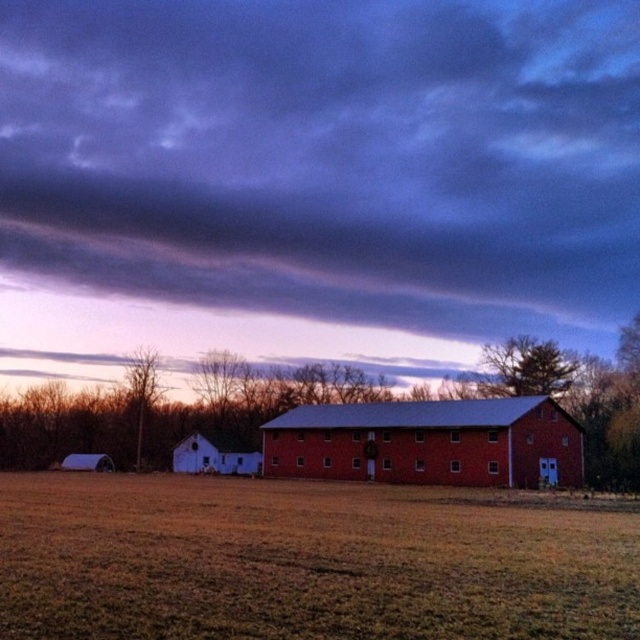
Is point (484, 118) in front of point (240, 449)?

No, (484, 118) is behind (240, 449).

Who is positioned more to the right, dark purple cloud at upper center or white matte barn at center?

From the viewer's perspective, dark purple cloud at upper center appears more on the right side.

Between point (308, 90) and point (172, 465), which one is positioned behind?

The point (308, 90) is behind.

At what (x,y) coordinates should I click in order to perform the action: click on dark purple cloud at upper center. Please return your answer as a coordinate pair (x, y). The width and height of the screenshot is (640, 640). Looking at the image, I should click on (316, 173).

Is point (268, 172) farther from camera compared to point (292, 464)?

Yes, it is.

Does point (333, 326) lie behind point (564, 477)?

Yes, point (333, 326) is farther from viewer.

Locate an element on the screen. dark purple cloud at upper center is located at coordinates (316, 173).

Who is more distant from viewer, (36, 515) or (368, 451)?

Positioned behind is point (368, 451).

Based on the photo, is brown grass at center smaller than red brick barn at center?

Incorrect, brown grass at center is not smaller in size than red brick barn at center.

At what (x,y) coordinates should I click in order to perform the action: click on brown grass at center. Please return your answer as a coordinate pair (x, y). Looking at the image, I should click on tap(304, 563).